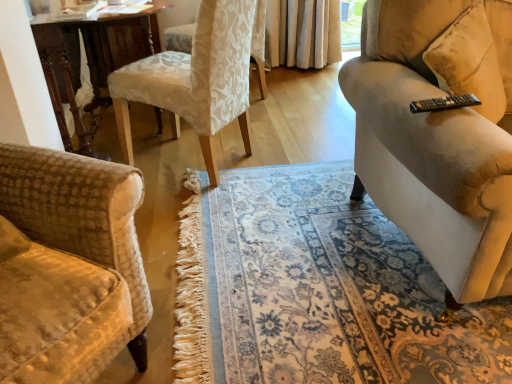
Find the location of a particular element. white fabric chair at center, the 1th chair from the front is located at coordinates (199, 77).

What is the approximate width of wooden table at center?

It is 27.97 inches.

This screenshot has height=384, width=512. I want to click on white fabric chair at center, which is the 2th chair from back to front, so pyautogui.click(x=199, y=77).

Is point (129, 80) positioned in front of point (251, 50)?

Yes.

Which of these two, white fabric chair at center, the 1th chair from the front, or white damask fabric chair at upper center, the 2th chair from the front, is bigger?

white fabric chair at center, the 1th chair from the front, is bigger.

From the picture: Considering the relative positions of white fabric chair at center, the 1th chair from the front, and white damask fabric chair at upper center, the 2th chair from the front, in the image provided, is white fabric chair at center, the 1th chair from the front, behind white damask fabric chair at upper center, the 2th chair from the front,?

That is False.

Which is more to the right, white fabric chair at center, which is the 2th chair from back to front, or wooden table at center?

white fabric chair at center, which is the 2th chair from back to front, is more to the right.

From the image's perspective, which one is positioned lower, white fabric chair at center, which is the 2th chair from back to front, or wooden table at center?

white fabric chair at center, which is the 2th chair from back to front, appears lower in the image.

Can you confirm if white fabric chair at center, which is the 2th chair from back to front, is bigger than wooden table at center?

No.

From a real-world perspective, does white fabric chair at center, which is the 2th chair from back to front, sit lower than wooden table at center?

No, from a real-world perspective, white fabric chair at center, which is the 2th chair from back to front, is not under wooden table at center.

From the image's perspective, is wooden table at center under white damask fabric chair at upper center, the 2th chair from the front?

Yes.

Does wooden table at center touch white damask fabric chair at upper center, the 2th chair from the front?

No, wooden table at center is not with white damask fabric chair at upper center, the 2th chair from the front.

Is wooden table at center to the left of white damask fabric chair at upper center, the 2th chair from the front, from the viewer's perspective?

Correct, you'll find wooden table at center to the left of white damask fabric chair at upper center, the 2th chair from the front.

Considering the relative sizes of white damask fabric chair at upper center, arranged as the first chair when viewed from the back, and white fabric chair at center, which is the 2th chair from back to front, in the image provided, is white damask fabric chair at upper center, arranged as the first chair when viewed from the back, thinner than white fabric chair at center, which is the 2th chair from back to front,?

No, white damask fabric chair at upper center, arranged as the first chair when viewed from the back, is not thinner than white fabric chair at center, which is the 2th chair from back to front.

Does white damask fabric chair at upper center, the 2th chair from the front, turn towards white fabric chair at center, which is the 2th chair from back to front?

No, white damask fabric chair at upper center, the 2th chair from the front, is not oriented towards white fabric chair at center, which is the 2th chair from back to front.

From the image's perspective, which is above, white damask fabric chair at upper center, arranged as the first chair when viewed from the back, or white fabric chair at center, which is the 2th chair from back to front?

white damask fabric chair at upper center, arranged as the first chair when viewed from the back, from the image's perspective.

From a real-world perspective, is wooden table at center on top of white fabric chair at center, which is the 2th chair from back to front?

No, from a real-world perspective, wooden table at center is not on top of white fabric chair at center, which is the 2th chair from back to front.

From the image's perspective, which object appears higher, wooden table at center or white fabric chair at center, which is the 2th chair from back to front?

wooden table at center is shown above in the image.

Which of these two, wooden table at center or white fabric chair at center, which is the 2th chair from back to front, is smaller?

Smaller between the two is white fabric chair at center, which is the 2th chair from back to front.

Considering the positions of objects wooden table at center and white fabric chair at center, which is the 2th chair from back to front, in the image provided, who is more to the left, wooden table at center or white fabric chair at center, which is the 2th chair from back to front,?

Positioned to the left is wooden table at center.

Find the location of a particular element. Image resolution: width=512 pixels, height=384 pixels. chair behind the wooden table at center is located at coordinates (259, 45).

Is white damask fabric chair at upper center, the 2th chair from the front, completely or partially outside of wooden table at center?

white damask fabric chair at upper center, the 2th chair from the front, is positioned outside wooden table at center.

From a real-world perspective, is white damask fabric chair at upper center, the 2th chair from the front, on wooden table at center?

Incorrect, from a real-world perspective, white damask fabric chair at upper center, the 2th chair from the front, is lower than wooden table at center.

Could you tell me if white damask fabric chair at upper center, the 2th chair from the front, is turned towards wooden table at center?

Yes, white damask fabric chair at upper center, the 2th chair from the front, is turned towards wooden table at center.

Locate an element on the screen. chair located above the white damask fabric chair at upper center, arranged as the first chair when viewed from the back (from a real-world perspective) is located at coordinates [x=199, y=77].

Where is `table behind the white fabric chair at center, the 1th chair from the front`? table behind the white fabric chair at center, the 1th chair from the front is located at coordinates (88, 63).

Which object lies nearer to the anchor point white damask fabric chair at upper center, the 2th chair from the front, wooden table at center or white fabric chair at center, which is the 2th chair from back to front?

wooden table at center is positioned closer to the anchor white damask fabric chair at upper center, the 2th chair from the front.

Estimate the real-world distances between objects in this image. Which object is closer to white fabric chair at center, the 1th chair from the front, wooden table at center or white damask fabric chair at upper center, arranged as the first chair when viewed from the back?

Among the two, wooden table at center is located nearer to white fabric chair at center, the 1th chair from the front.

Which object lies nearer to the anchor point wooden table at center, white fabric chair at center, which is the 2th chair from back to front, or white damask fabric chair at upper center, the 2th chair from the front?

Among the two, white fabric chair at center, which is the 2th chair from back to front, is located nearer to wooden table at center.

In the scene shown: Looking at the image, which one is located further to white fabric chair at center, which is the 2th chair from back to front, white damask fabric chair at upper center, the 2th chair from the front, or wooden table at center?

white damask fabric chair at upper center, the 2th chair from the front, is further to white fabric chair at center, which is the 2th chair from back to front.

Looking at the image, which one is located further to wooden table at center, white damask fabric chair at upper center, arranged as the first chair when viewed from the back, or white fabric chair at center, which is the 2th chair from back to front?

The object further to wooden table at center is white damask fabric chair at upper center, arranged as the first chair when viewed from the back.

From the image, which object appears to be nearer to white damask fabric chair at upper center, arranged as the first chair when viewed from the back, white fabric chair at center, which is the 2th chair from back to front, or wooden table at center?

The object closer to white damask fabric chair at upper center, arranged as the first chair when viewed from the back, is wooden table at center.

Locate an element on the screen. This screenshot has height=384, width=512. table positioned between white fabric chair at center, which is the 2th chair from back to front, and white damask fabric chair at upper center, the 2th chair from the front, from near to far is located at coordinates (88, 63).